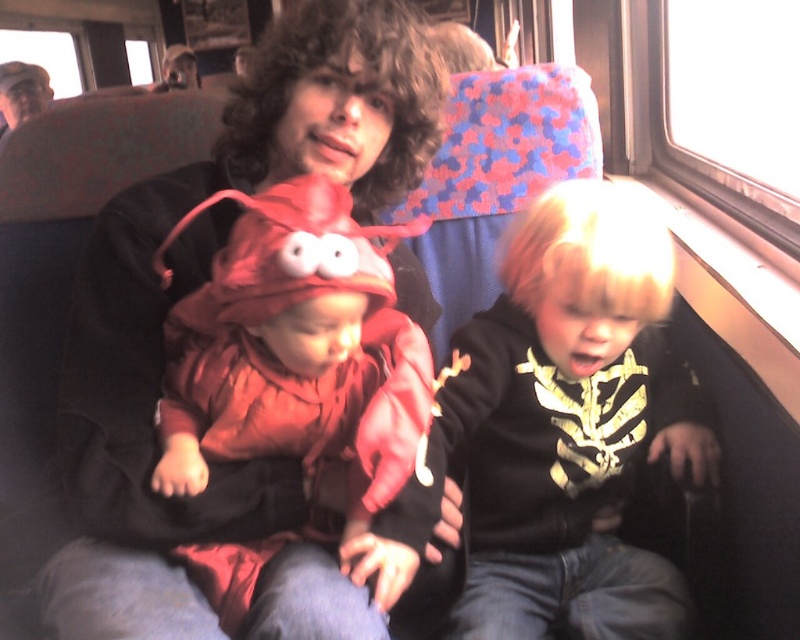
Question: Is rubber lobster at center bigger than matte black cap at upper left?

Choices:
 (A) yes
 (B) no

Answer: (B)

Question: Among these objects, which one is nearest to the camera?

Choices:
 (A) black velvet sweater at right
 (B) rubber lobster at center
 (C) matte black cap at upper left

Answer: (B)

Question: Which of the following is the closest to the observer?

Choices:
 (A) (34, 77)
 (B) (470, 516)

Answer: (B)

Question: In this image, where is black velvet sweater at right located relative to matte black cap at upper left?

Choices:
 (A) below
 (B) above

Answer: (A)

Question: Which point is closer to the camera taking this photo?

Choices:
 (A) [x=562, y=506]
 (B) [x=24, y=92]
 (C) [x=238, y=564]

Answer: (C)

Question: Can you confirm if black velvet sweater at right is wider than matte black cap at upper left?

Choices:
 (A) yes
 (B) no

Answer: (A)